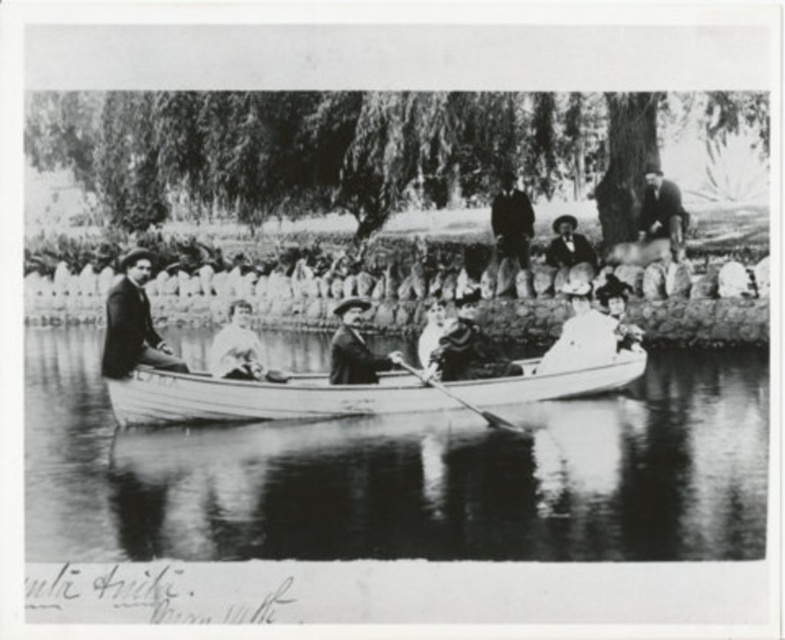
Who is taller, white satin dress at center or smooth leather jacket at upper right?

Standing taller between the two is smooth leather jacket at upper right.

I want to click on white satin dress at center, so click(585, 330).

I want to click on white satin dress at center, so click(x=585, y=330).

Is smooth white canoe at center to the left of white satin dress at center from the viewer's perspective?

Indeed, smooth white canoe at center is positioned on the left side of white satin dress at center.

Between smooth white canoe at center and white satin dress at center, which one has less height?

smooth white canoe at center

This screenshot has width=785, height=640. Find the location of `smooth white canoe at center`. smooth white canoe at center is located at coordinates click(349, 392).

Which of these two, smooth white water at center or wooden polished paddle at center, stands shorter?

wooden polished paddle at center

Does smooth white water at center have a larger size compared to wooden polished paddle at center?

Correct, smooth white water at center is larger in size than wooden polished paddle at center.

Does point (541, 468) come closer to viewer compared to point (424, 380)?

Yes, it is in front of point (424, 380).

What are the coordinates of `smooth white water at center` in the screenshot? It's located at (404, 474).